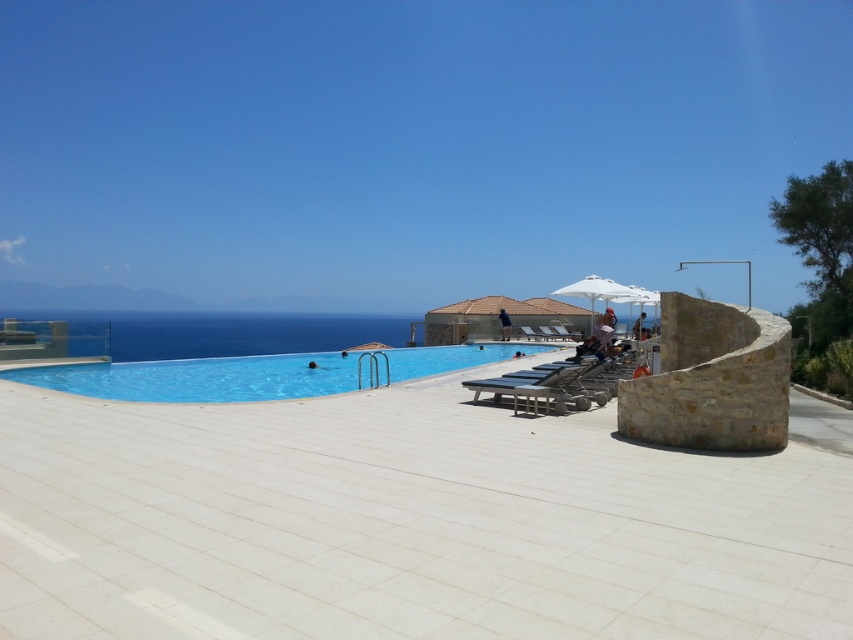
You are standing at the edge of the infinity pool and want to place a new lounge chair. The coordinates for the desired location are point (595, 289). Is there already an object at that location?

Yes, there is already a white fabric umbrella at center located at point (595, 289).

You are a guest at this resort and want to place a 2.5 meter long sun lounger between the white fabric umbrella at center and the white fabric umbrella at upper center. Is there enough space between them to fit the sun lounger?

The distance between the white fabric umbrella at center and the white fabric umbrella at upper center is 1.96 meters. Since the sun lounger is 2.5 meters long, it is longer than the available space. Therefore, the sun lounger cannot be placed between them.